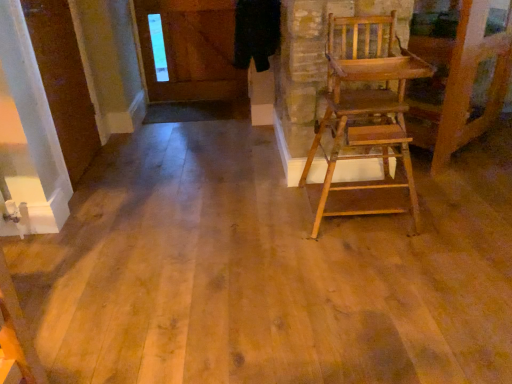
Question: Is white glossy door at upper left wider or thinner than wooden high chair at right?

Choices:
 (A) thin
 (B) wide

Answer: (A)

Question: Considering the positions of point tap(77, 117) and point tap(354, 16), is point tap(77, 117) closer or farther from the camera than point tap(354, 16)?

Choices:
 (A) closer
 (B) farther

Answer: (B)

Question: From their relative heights in the image, would you say white glossy door at upper left is taller or shorter than wooden high chair at right?

Choices:
 (A) tall
 (B) short

Answer: (A)

Question: Relative to white glossy door at upper left, is wooden high chair at right in front or behind?

Choices:
 (A) behind
 (B) front

Answer: (B)

Question: From the image's perspective, is wooden high chair at right above or below white glossy door at upper left?

Choices:
 (A) below
 (B) above

Answer: (A)

Question: From a real-world perspective, is wooden high chair at right physically located above or below white glossy door at upper left?

Choices:
 (A) above
 (B) below

Answer: (B)

Question: In terms of width, does wooden high chair at right look wider or thinner when compared to white glossy door at upper left?

Choices:
 (A) wide
 (B) thin

Answer: (A)